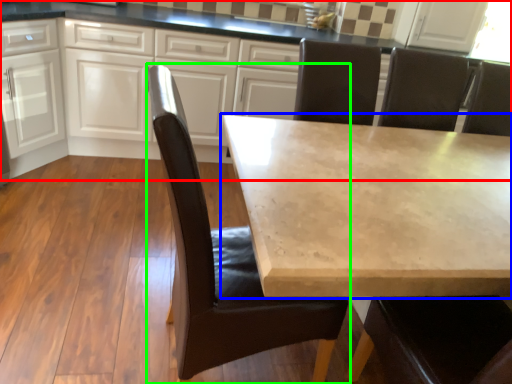
Question: Based on their relative distances, which object is farther from cabinetry (highlighted by a red box)? Choose from table (highlighted by a blue box) and chair (highlighted by a green box).

Choices:
 (A) table
 (B) chair

Answer: (B)